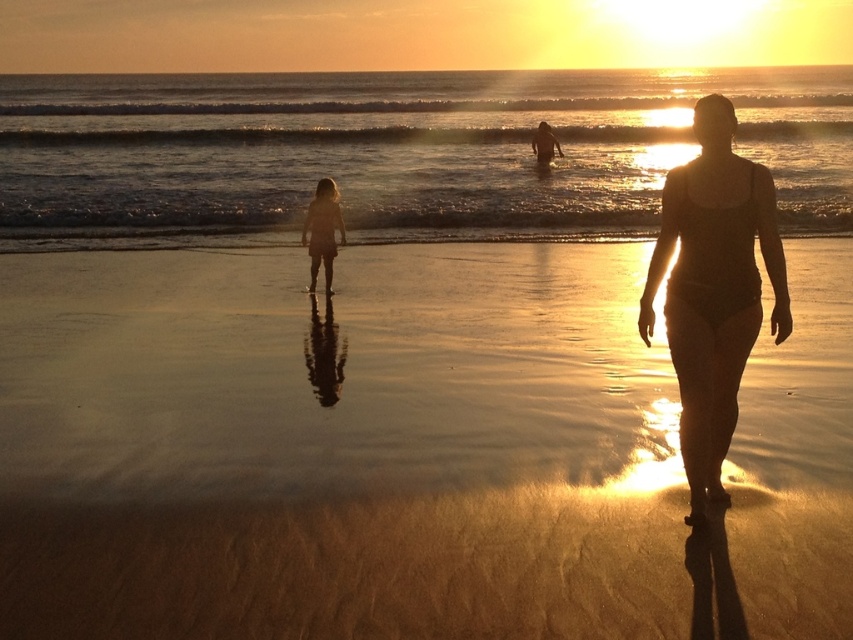
Question: Does sandy beach at center have a larger size compared to golden reflective water at center?

Choices:
 (A) yes
 (B) no

Answer: (B)

Question: Which point is farther to the camera?

Choices:
 (A) golden reflective water at center
 (B) satin black swimsuit at right
 (C) silky blonde hair at center
 (D) sandy beach at center

Answer: (A)

Question: From the image, what is the correct spatial relationship of golden reflective water at center in relation to satin black swimsuit at right?

Choices:
 (A) right
 (B) left

Answer: (B)

Question: Which is farther from the sandy beach at center?

Choices:
 (A) golden reflective water at center
 (B) satin black swimsuit at right
 (C) silky blonde hair at center

Answer: (A)

Question: Among these points, which one is farthest from the camera?

Choices:
 (A) (267, 163)
 (B) (312, 225)
 (C) (757, 166)

Answer: (A)

Question: Is golden reflective water at center above silky blonde hair at center?

Choices:
 (A) no
 (B) yes

Answer: (B)